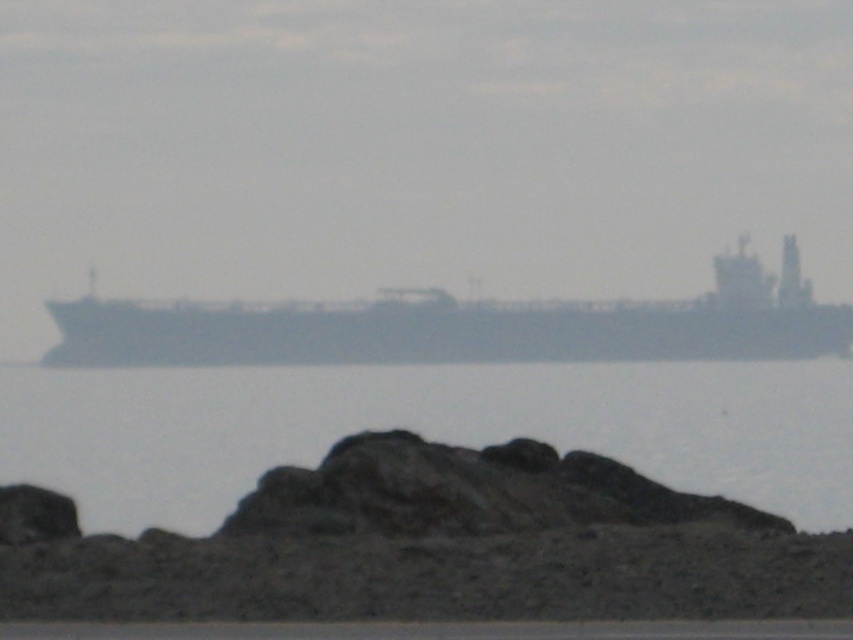
Question: Which point is farther to the camera?

Choices:
 (A) (219, 394)
 (B) (422, 348)

Answer: (B)

Question: Does transparent water at center appear under gray matte ship at center?

Choices:
 (A) no
 (B) yes

Answer: (B)

Question: Which point is farther to the camera?

Choices:
 (A) transparent water at center
 (B) gray matte ship at center

Answer: (B)

Question: Is transparent water at center further to camera compared to gray matte ship at center?

Choices:
 (A) no
 (B) yes

Answer: (A)

Question: Which of the following is the farthest from the observer?

Choices:
 (A) gray matte ship at center
 (B) transparent water at center

Answer: (A)

Question: Does transparent water at center appear on the right side of gray matte ship at center?

Choices:
 (A) no
 (B) yes

Answer: (A)